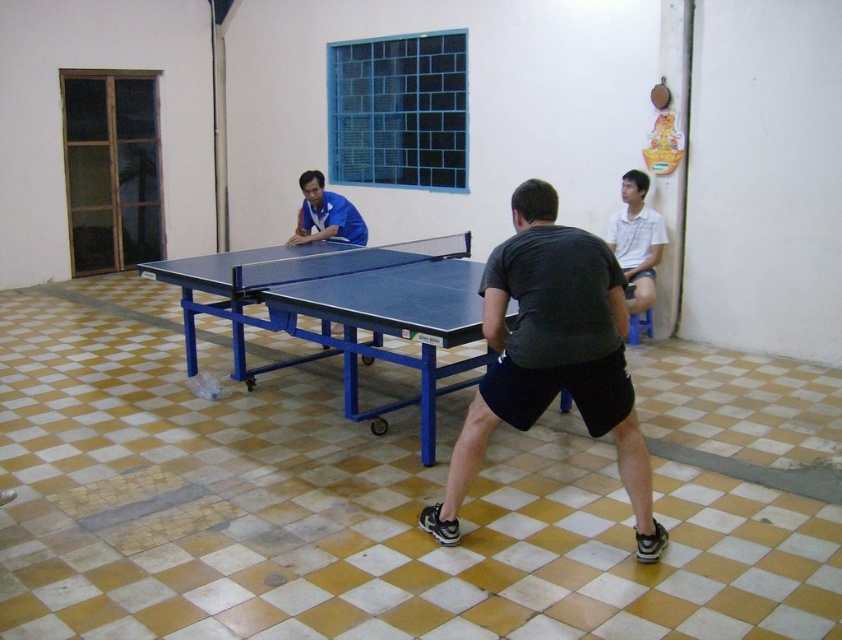
Question: Is white cotton shirt at upper right wider than matte blue shirt at center?

Choices:
 (A) yes
 (B) no

Answer: (B)

Question: Which of the following is the closest to the observer?

Choices:
 (A) matte blue shirt at center
 (B) white cotton shirt at upper right

Answer: (A)

Question: Which point is closer to the camera?

Choices:
 (A) dark gray fabric shirt at center
 (B) matte blue shirt at center

Answer: (A)

Question: Does dark gray fabric shirt at center appear over matte blue shirt at center?

Choices:
 (A) no
 (B) yes

Answer: (A)

Question: Which of the following is the farthest from the observer?

Choices:
 (A) (312, 173)
 (B) (545, 241)

Answer: (A)

Question: Can you confirm if dark gray fabric shirt at center is thinner than white cotton shirt at upper right?

Choices:
 (A) yes
 (B) no

Answer: (B)